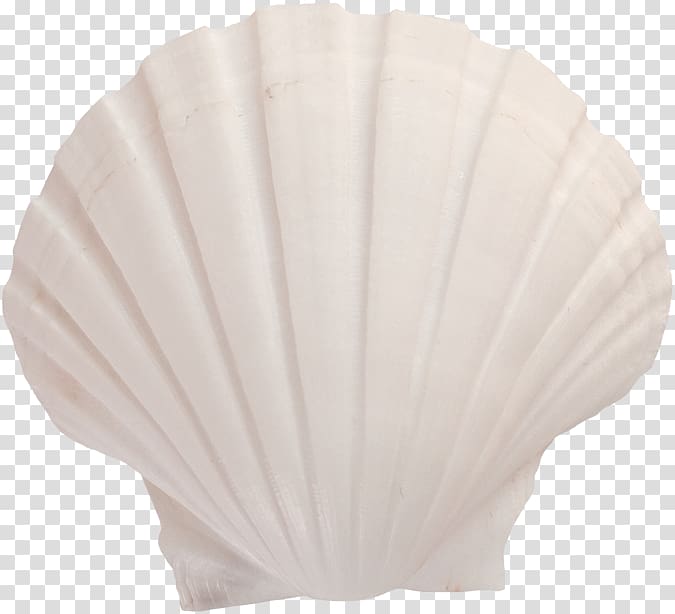
I want to click on lower right tile background, so coord(657,494).